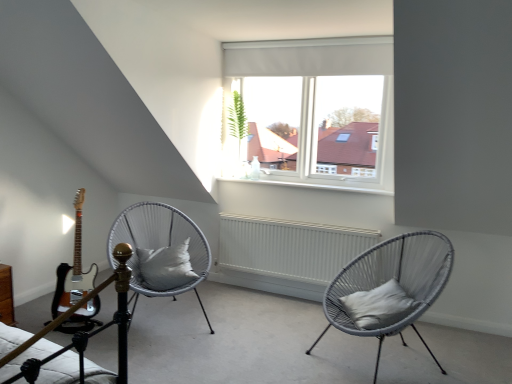
Question: Can you confirm if white matte radiator at center is smaller than gray fabric pillow at right, arranged as the 1th pillow when viewed from the right?

Choices:
 (A) no
 (B) yes

Answer: (A)

Question: Would you say white matte radiator at center is outside gray fabric pillow at right, placed as the 2th pillow when sorted from back to front?

Choices:
 (A) yes
 (B) no

Answer: (A)

Question: From the image's perspective, does white matte radiator at center appear higher than gray fabric pillow at right, arranged as the 2th pillow when viewed from the left?

Choices:
 (A) yes
 (B) no

Answer: (A)

Question: Is white matte radiator at center positioned far away from gray fabric pillow at right, arranged as the 2th pillow when viewed from the left?

Choices:
 (A) yes
 (B) no

Answer: (B)

Question: Is white matte radiator at center at the right side of gray fabric pillow at right, arranged as the 2th pillow when viewed from the left?

Choices:
 (A) yes
 (B) no

Answer: (B)

Question: From their relative heights in the image, would you say gray fabric pillow at right, placed as the 2th pillow when sorted from back to front, is taller or shorter than white woven chair at center, placed as the 1th chair when sorted from left to right?

Choices:
 (A) tall
 (B) short

Answer: (B)

Question: From the image's perspective, relative to white woven chair at center, placed as the 1th chair when sorted from left to right, is gray fabric pillow at right, which is counted as the first pillow, starting from the front, above or below?

Choices:
 (A) below
 (B) above

Answer: (A)

Question: Would you say gray fabric pillow at right, which is counted as the first pillow, starting from the front, is inside or outside white woven chair at center, which is the 2th chair from right to left?

Choices:
 (A) outside
 (B) inside

Answer: (A)

Question: Is point (399, 319) positioned closer to the camera than point (131, 288)?

Choices:
 (A) closer
 (B) farther

Answer: (A)

Question: Based on their positions, is white matte radiator at center located to the left or right of woven grey chair at center, the 1th chair viewed from the right?

Choices:
 (A) left
 (B) right

Answer: (A)

Question: From a real-world perspective, is white matte radiator at center positioned above or below woven grey chair at center, the second chair viewed from the left?

Choices:
 (A) below
 (B) above

Answer: (A)

Question: From the image's perspective, is white matte radiator at center positioned above or below woven grey chair at center, the 1th chair viewed from the right?

Choices:
 (A) above
 (B) below

Answer: (A)

Question: Is white matte radiator at center spatially inside woven grey chair at center, the second chair viewed from the left, or outside of it?

Choices:
 (A) outside
 (B) inside

Answer: (A)

Question: Based on their positions, is white glossy electric guitar at left located to the left or right of woven grey chair at center, the second chair viewed from the left?

Choices:
 (A) left
 (B) right

Answer: (A)

Question: Is white glossy electric guitar at left spatially inside woven grey chair at center, the 1th chair viewed from the right, or outside of it?

Choices:
 (A) inside
 (B) outside

Answer: (B)